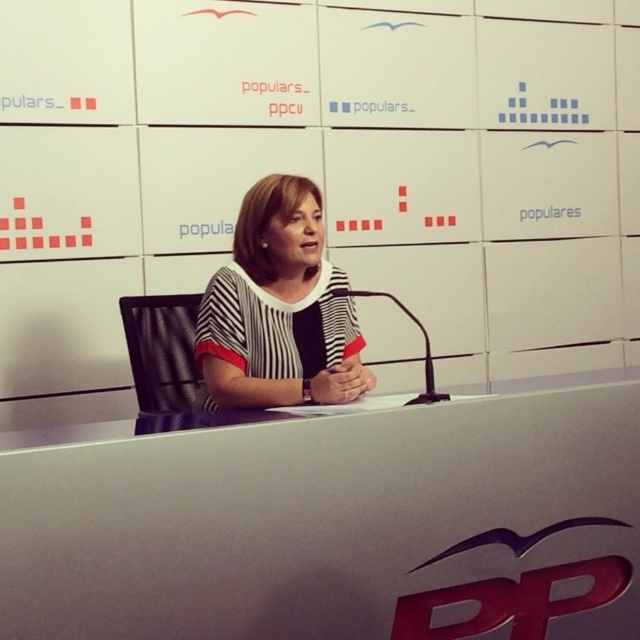
Is white glossy table at center taller than striped fabric at center?

Incorrect, white glossy table at center's height is not larger of striped fabric at center's.

From the picture: Can you confirm if white glossy table at center is wider than striped fabric at center?

Indeed, white glossy table at center has a greater width compared to striped fabric at center.

The width and height of the screenshot is (640, 640). Describe the element at coordinates (336, 525) in the screenshot. I see `white glossy table at center` at that location.

At what (x,y) coordinates should I click in order to perform the action: click on white glossy table at center. Please return your answer as a coordinate pair (x, y). Looking at the image, I should click on pyautogui.click(x=336, y=525).